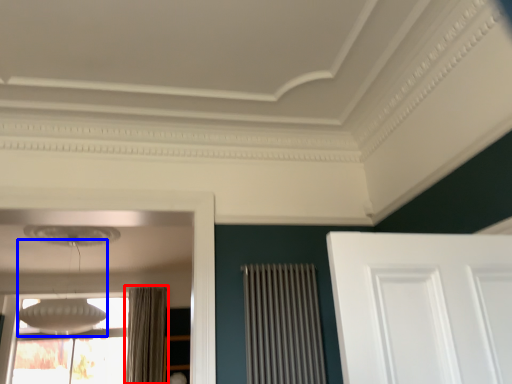
Question: Which of the following is the farthest to the observer, curtain (highlighted by a red box) or lamp (highlighted by a blue box)?

Choices:
 (A) curtain
 (B) lamp

Answer: (A)